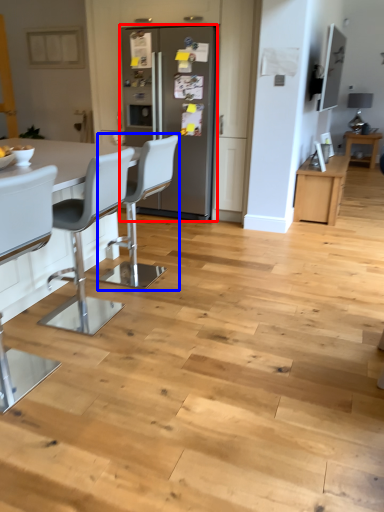
Question: Which of the following is the farthest to the observer, fridge (highlighted by a red box) or chair (highlighted by a blue box)?

Choices:
 (A) fridge
 (B) chair

Answer: (A)